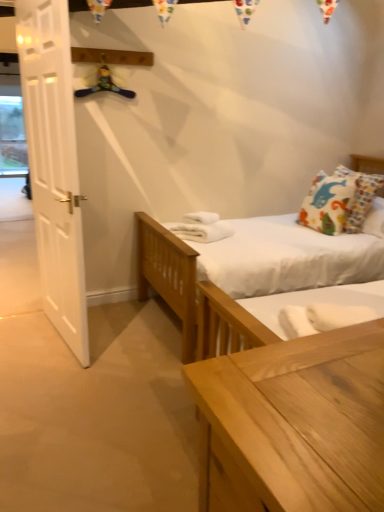
Question: Is printed fabric pillow at upper right to the left of yellow fabric hanger at upper center from the viewer's perspective?

Choices:
 (A) no
 (B) yes

Answer: (A)

Question: Is the position of printed fabric pillow at upper right more distant than that of yellow fabric hanger at upper center?

Choices:
 (A) yes
 (B) no

Answer: (A)

Question: Could yellow fabric hanger at upper center be considered to be inside printed fabric pillow at upper right?

Choices:
 (A) yes
 (B) no

Answer: (B)

Question: Considering the relative sizes of printed fabric pillow at upper right and yellow fabric hanger at upper center in the image provided, is printed fabric pillow at upper right wider than yellow fabric hanger at upper center?

Choices:
 (A) yes
 (B) no

Answer: (A)

Question: Is printed fabric pillow at upper right closer to the viewer compared to yellow fabric hanger at upper center?

Choices:
 (A) no
 (B) yes

Answer: (A)

Question: Is printed fabric pillow at upper right oriented away from yellow fabric hanger at upper center?

Choices:
 (A) no
 (B) yes

Answer: (A)

Question: Is yellow fabric hanger at upper center beside printed fabric pillow at upper right?

Choices:
 (A) yes
 (B) no

Answer: (B)

Question: Considering the relative positions of yellow fabric hanger at upper center and printed fabric pillow at upper right in the image provided, is yellow fabric hanger at upper center to the left of printed fabric pillow at upper right from the viewer's perspective?

Choices:
 (A) yes
 (B) no

Answer: (A)

Question: Is yellow fabric hanger at upper center turned away from printed fabric pillow at upper right?

Choices:
 (A) yes
 (B) no

Answer: (B)

Question: Considering the relative positions of yellow fabric hanger at upper center and printed fabric pillow at upper right in the image provided, is yellow fabric hanger at upper center in front of printed fabric pillow at upper right?

Choices:
 (A) no
 (B) yes

Answer: (B)

Question: Is yellow fabric hanger at upper center completely or partially outside of printed fabric pillow at upper right?

Choices:
 (A) yes
 (B) no

Answer: (A)

Question: From the image's perspective, is yellow fabric hanger at upper center above printed fabric pillow at upper right?

Choices:
 (A) no
 (B) yes

Answer: (B)

Question: From a real-world perspective, is white wooden door at left on top of printed fabric pillow at upper right?

Choices:
 (A) no
 (B) yes

Answer: (B)